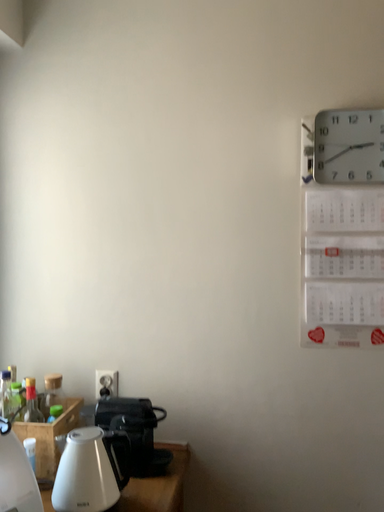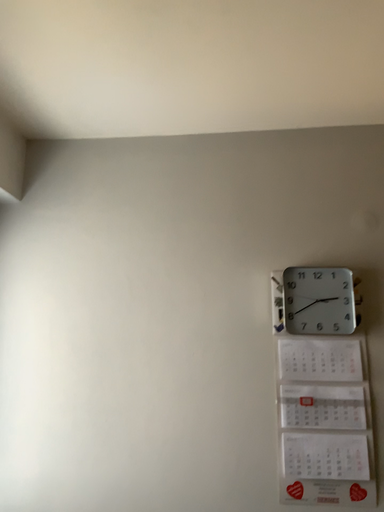
Question: Which way did the camera rotate in the video?

Choices:
 (A) rotated downward
 (B) rotated upward

Answer: (B)